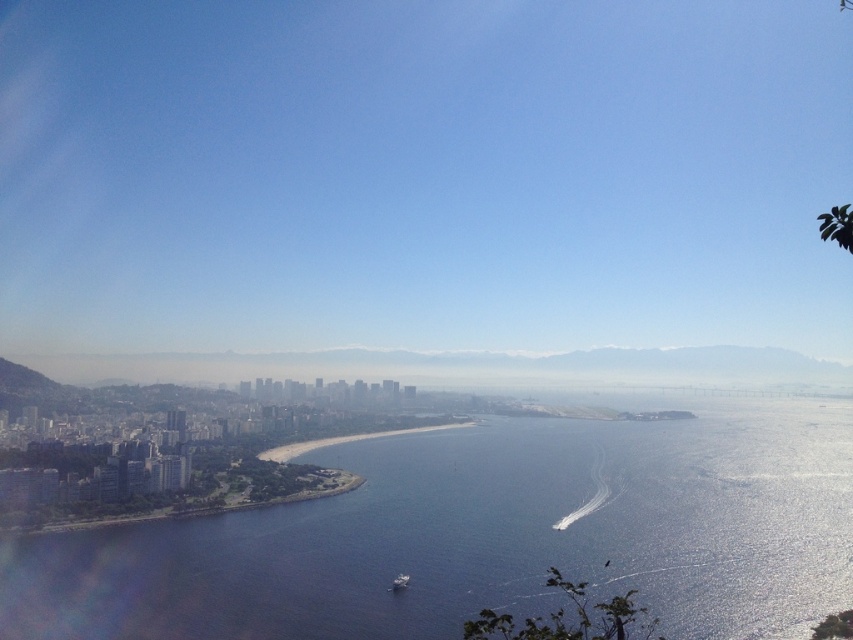
Question: Which point is closer to the camera taking this photo?

Choices:
 (A) (398, 580)
 (B) (347, 438)
 (C) (432, 618)

Answer: (A)

Question: Does blue liquid water at lower left appear on the left side of metallic gray boat at lower center?

Choices:
 (A) yes
 (B) no

Answer: (B)

Question: Which object is positioned closest to the metallic gray boat at lower center?

Choices:
 (A) golden sand beach at center
 (B) blue liquid water at lower left

Answer: (A)

Question: Can you confirm if blue liquid water at lower left is bigger than golden sand beach at center?

Choices:
 (A) no
 (B) yes

Answer: (B)

Question: Among these objects, which one is farthest from the camera?

Choices:
 (A) metallic gray boat at lower center
 (B) golden sand beach at center

Answer: (A)

Question: Is golden sand beach at center smaller than metallic gray boat at lower center?

Choices:
 (A) yes
 (B) no

Answer: (B)